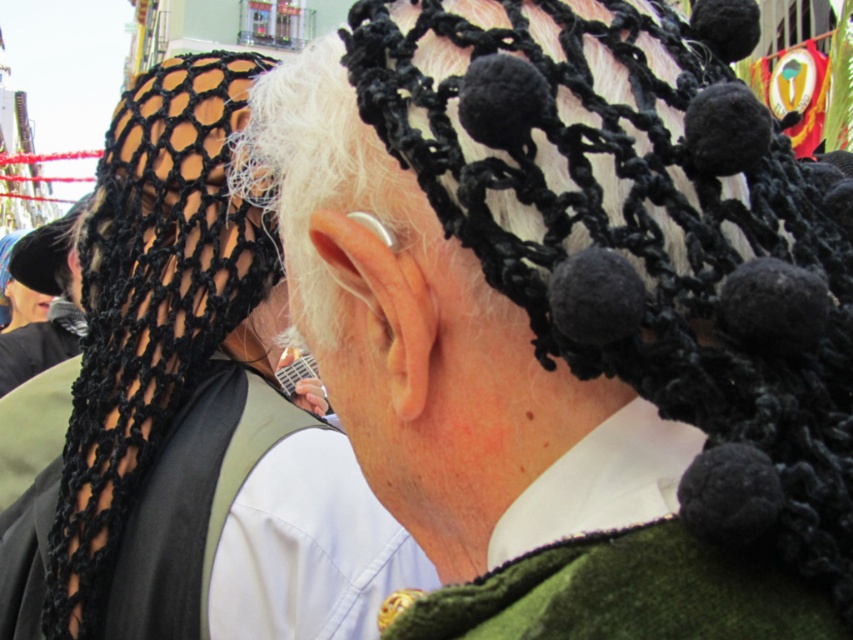
Between point (68, 625) and point (4, 570), which one is positioned in front?

Point (68, 625) is more forward.

Is black mesh headscarf at upper left thinner than black knitted scarf at upper left?

No, black mesh headscarf at upper left is not thinner than black knitted scarf at upper left.

Is point (154, 346) positioned in front of point (323, 554)?

No, it is not.

Find the location of `black mesh headscarf at upper left`. black mesh headscarf at upper left is located at coordinates (189, 413).

Looking at this image, does black knitted hat at center appear on the left side of black mesh headscarf at upper left?

Incorrect, black knitted hat at center is not on the left side of black mesh headscarf at upper left.

Is black knitted hat at center thinner than black mesh headscarf at upper left?

Yes, black knitted hat at center is thinner than black mesh headscarf at upper left.

Image resolution: width=853 pixels, height=640 pixels. What are the coordinates of `black knitted hat at center` in the screenshot? It's located at tap(566, 308).

Looking at this image, who is positioned more to the right, black knitted hat at center or black knitted scarf at upper left?

black knitted hat at center

Does black knitted hat at center have a larger size compared to black knitted scarf at upper left?

Yes, black knitted hat at center is bigger than black knitted scarf at upper left.

This screenshot has width=853, height=640. Identify the location of black knitted hat at center. (566, 308).